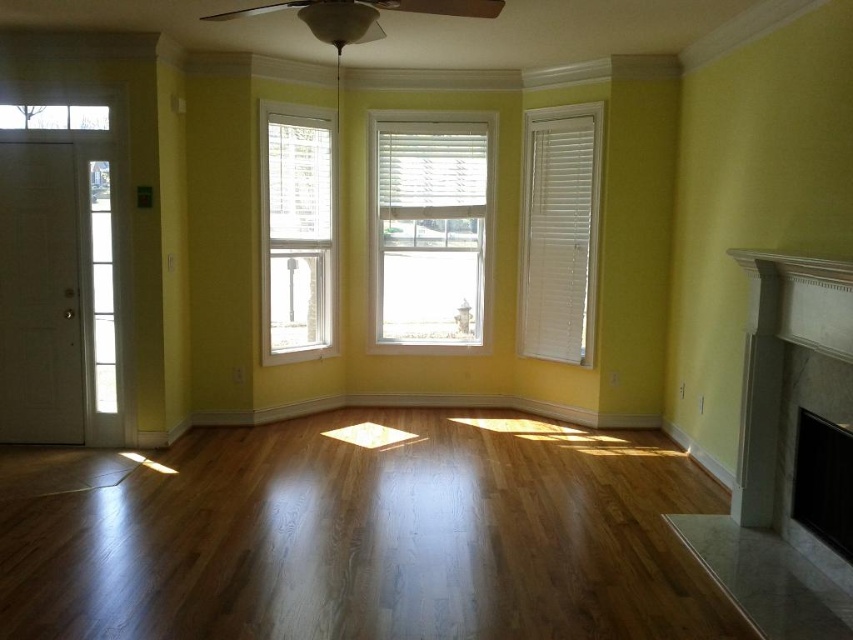
Does point (434, 237) come farther from viewer compared to point (263, 148)?

Yes.

Based on the photo, is white matte window at center smaller than white wood window at center?

Correct, white matte window at center occupies less space than white wood window at center.

This screenshot has height=640, width=853. What are the coordinates of `white matte window at center` in the screenshot? It's located at (428, 228).

Is shiny brown hardwood floor at center thinner than white matte window at center?

No, shiny brown hardwood floor at center is not thinner than white matte window at center.

Is shiny brown hardwood floor at center smaller than white matte window at center?

No.

Is point (33, 470) positioned after point (422, 256)?

No, it is in front of (422, 256).

Find the location of a particular element. The height and width of the screenshot is (640, 853). shiny brown hardwood floor at center is located at coordinates (360, 536).

Is point (770, 387) positioned behind point (596, 157)?

No, (770, 387) is closer to viewer.

Image resolution: width=853 pixels, height=640 pixels. I want to click on white marble fireplace at right, so click(775, 451).

Identify the location of white marble fireplace at right. (775, 451).